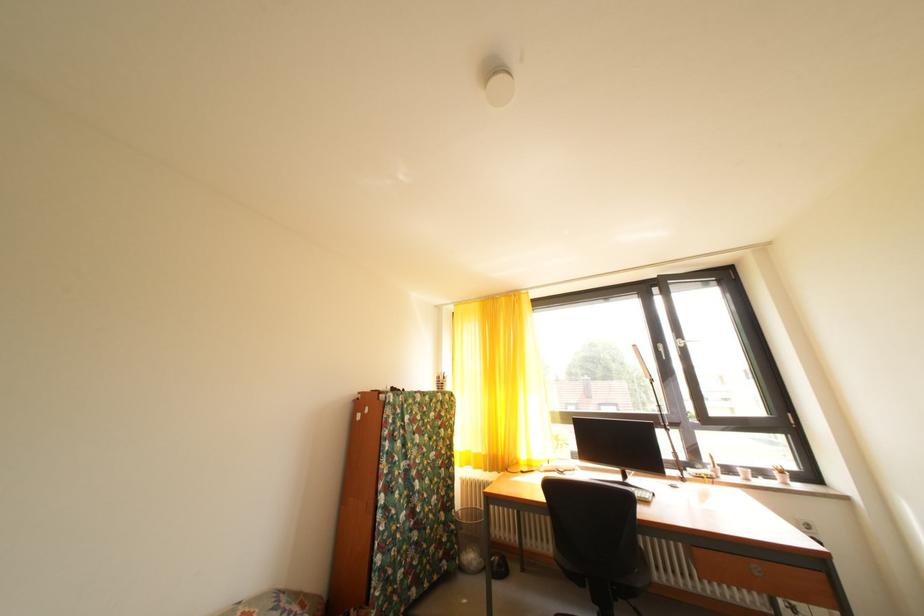
This screenshot has height=616, width=924. What do you see at coordinates (662, 350) in the screenshot?
I see `the window handle` at bounding box center [662, 350].